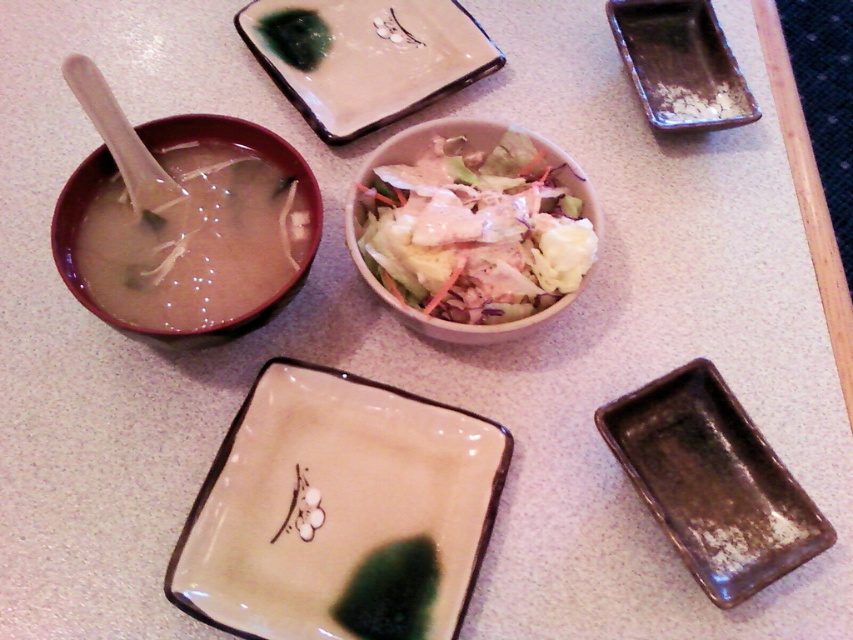
You are a person sitting at the table and want to reach for the brown glazed tray at upper right and the brown ceramic bowl at upper left. Which one can you reach first without moving your chair?

The brown glazed tray at upper right can be reached first because it is closer to you than the brown ceramic bowl at upper left.

You are a food delivery person who needs to place a hot plate on the table. The hot plate must be placed between the brown glazed tray at upper right and the brown ceramic bowl at upper left. Can you fit it there?

The brown glazed tray at upper right is located above the brown ceramic bowl at upper left, so there is space between them. The hot plate can be placed in the area between the two objects.